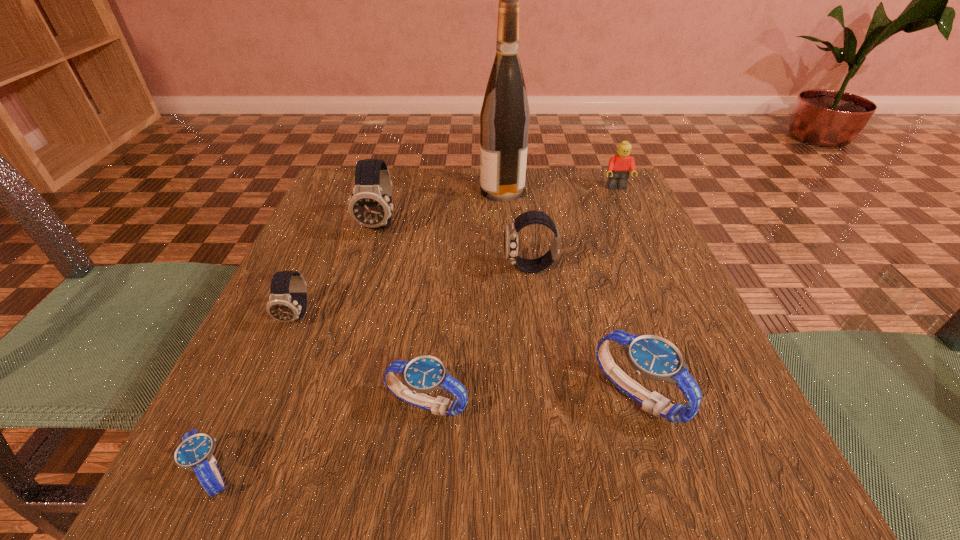
At what (x,y) coordinates should I click in order to perform the action: click on the third closest object to the rightmost object. Please return your answer as a coordinate pair (x, y). This screenshot has width=960, height=540. Looking at the image, I should click on (370, 205).

This screenshot has height=540, width=960. I want to click on object that is the sixth closest one to the second dark watch from right to left, so click(653, 357).

Select which watch is the second closest to the rightmost watch. Please provide its 2D coordinates. Your answer should be formatted as a tuple, i.e. [(x, y)], where the tuple contains the x and y coordinates of a point satisfying the conditions above.

[(511, 231)]

This screenshot has width=960, height=540. I want to click on the third closest watch to the second farthest watch, so point(424,374).

At what (x,y) coordinates should I click in order to perform the action: click on dark watch object that ranks as the closest to the biggest dark watch. Please return your answer as a coordinate pair (x, y). The width and height of the screenshot is (960, 540). Looking at the image, I should click on (282, 306).

Select which dark watch appears as the closest to the fifth nearest watch. Please provide its 2D coordinates. Your answer should be formatted as a tuple, i.e. [(x, y)], where the tuple contains the x and y coordinates of a point satisfying the conditions above.

[(370, 205)]

Locate an element on the screen. the second closest blue watch to the rightmost object is located at coordinates (424, 374).

Find the location of `the closest blue watch to the shortest watch`. the closest blue watch to the shortest watch is located at coordinates (424, 374).

Where is `vacant space that satisfies the following two spatial constraints: 1. on the face of the fourth nearest watch; 2. on the right side of the rightmost blue watch`? Image resolution: width=960 pixels, height=540 pixels. vacant space that satisfies the following two spatial constraints: 1. on the face of the fourth nearest watch; 2. on the right side of the rightmost blue watch is located at coordinates (263, 395).

Find the location of a particular element. free point that satisfies the following two spatial constraints: 1. on the face of the rightmost blue watch; 2. on the right side of the farthest watch is located at coordinates (330, 395).